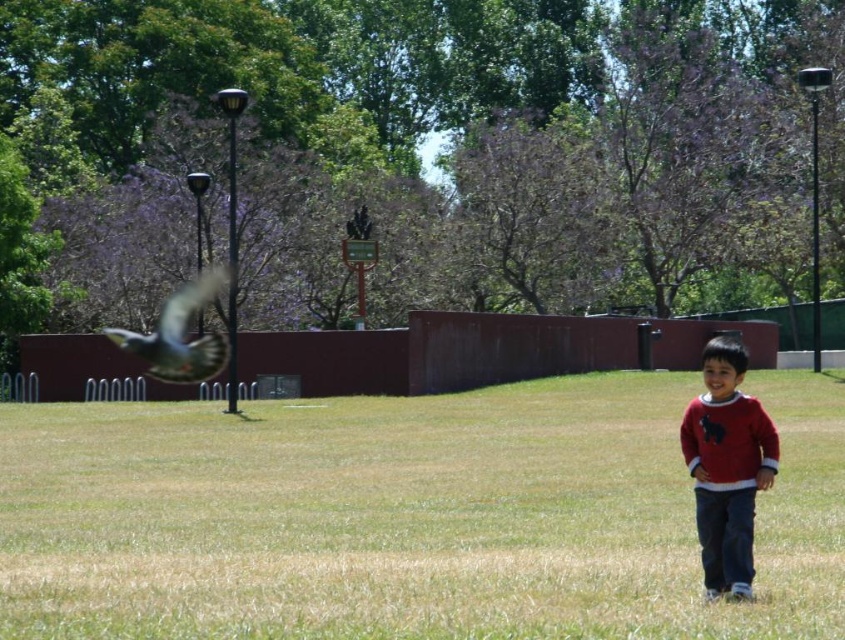
Question: Can you confirm if red cotton sweater at lower right is thinner than gray feathered bird at left?

Choices:
 (A) no
 (B) yes

Answer: (B)

Question: Is green grass at lower right to the right of red cotton sweater at lower right from the viewer's perspective?

Choices:
 (A) yes
 (B) no

Answer: (B)

Question: Which point is farther to the camera?

Choices:
 (A) red cotton sweater at lower right
 (B) gray feathered bird at left

Answer: (B)

Question: Which is nearer to the green grass at lower right?

Choices:
 (A) gray feathered bird at left
 (B) red cotton sweater at lower right

Answer: (B)

Question: Among these objects, which one is nearest to the camera?

Choices:
 (A) gray feathered bird at left
 (B) green grass at lower right
 (C) red cotton sweater at lower right

Answer: (B)

Question: Is green grass at lower right to the left of red cotton sweater at lower right from the viewer's perspective?

Choices:
 (A) yes
 (B) no

Answer: (A)